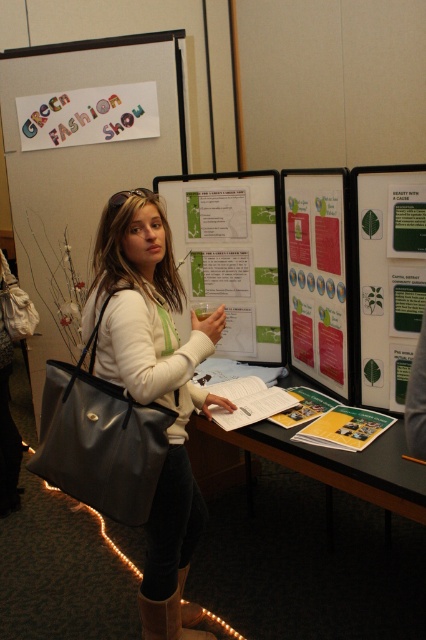
Does matte black bag at center have a smaller size compared to matte paper poster at center?

No, matte black bag at center is not smaller than matte paper poster at center.

Can you confirm if matte black bag at center is positioned above matte paper poster at center?

No, matte black bag at center is not above matte paper poster at center.

Is point (186, 500) in front of point (321, 342)?

That is True.

The height and width of the screenshot is (640, 426). I want to click on matte black bag at center, so click(x=155, y=387).

Does green paper poster at center appear over matte paper table at center?

Yes.

Is green paper poster at center closer to camera compared to matte paper table at center?

No, it is not.

The image size is (426, 640). I want to click on green paper poster at center, so click(x=230, y=253).

Where is `green paper poster at center`? This screenshot has width=426, height=640. green paper poster at center is located at coordinates (230, 253).

Is point (31, 364) closer to viewer compared to point (244, 323)?

No, it is behind (244, 323).

Is matte white poster at upper left positioned behind green paper poster at center?

Yes, matte white poster at upper left is further from the viewer.

Is point (88, 52) behind point (195, 220)?

Yes, it is.

Where is `matte white poster at upper left`? The height and width of the screenshot is (640, 426). matte white poster at upper left is located at coordinates coord(81,157).